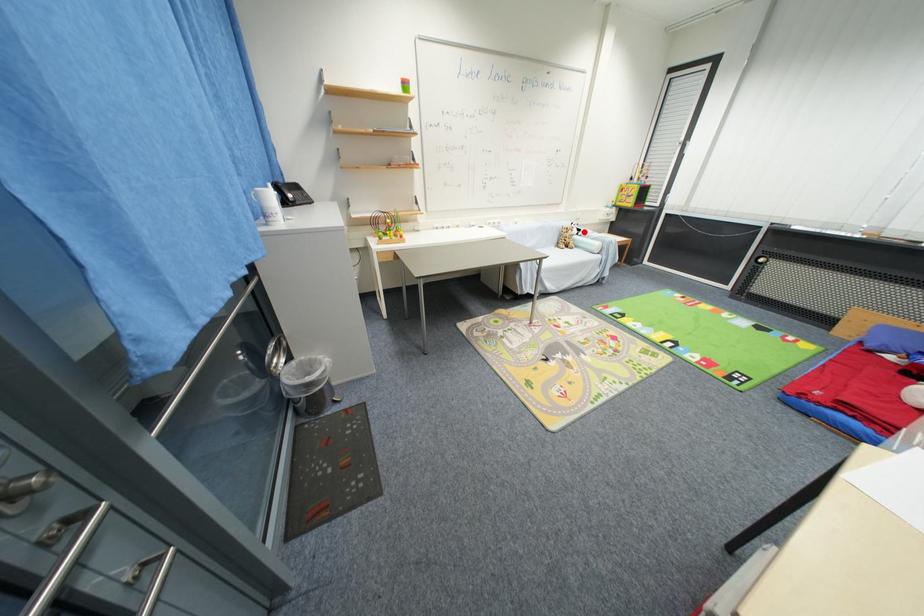
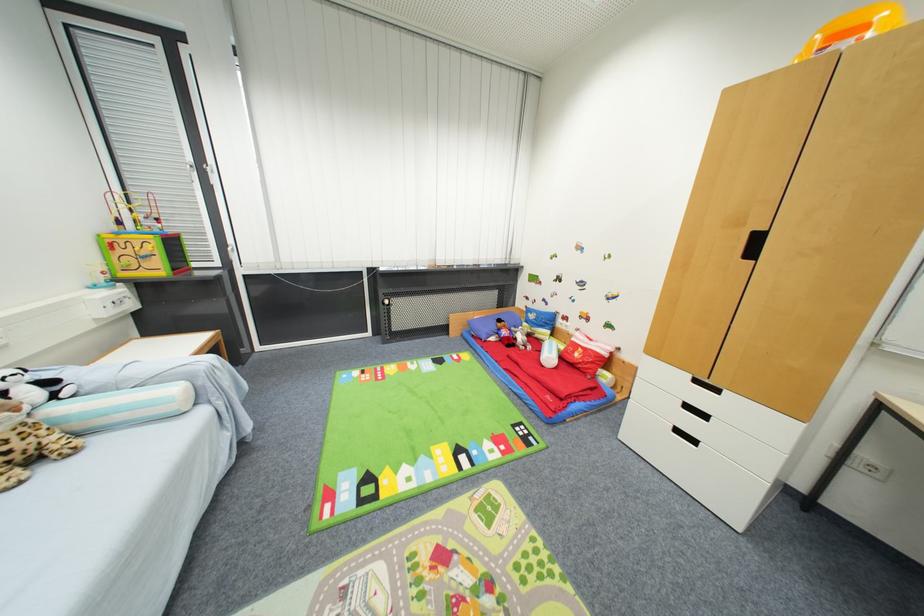
In the second image, find the point that corresponds to the highlighted location in the first image.

(54, 384)